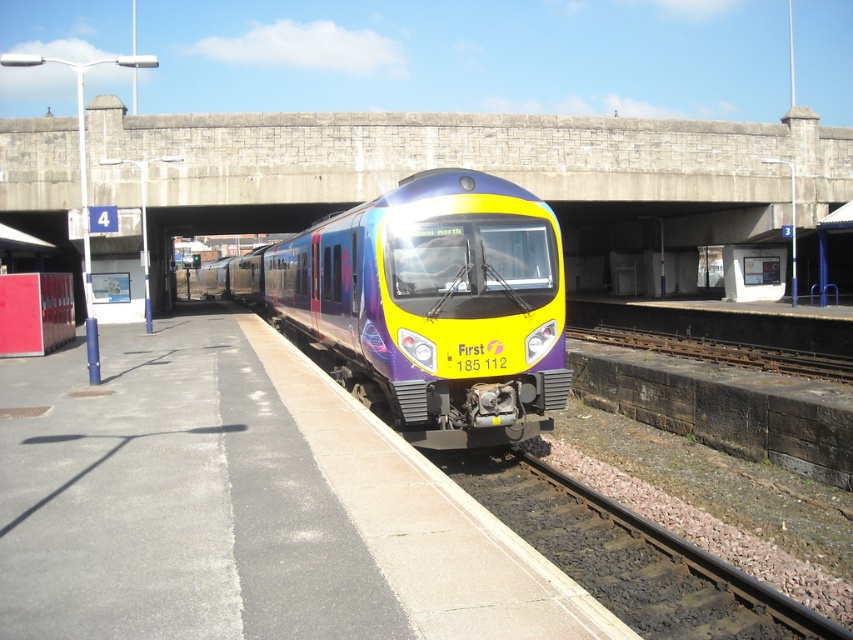
Question: Does matte purple train at center come in front of rusty metal track at lower right?

Choices:
 (A) yes
 (B) no

Answer: (A)

Question: Which of the following is the closest to the observer?

Choices:
 (A) rusty metal track at lower right
 (B) black gravel train track at lower center

Answer: (B)

Question: Which point is closer to the camera?

Choices:
 (A) smooth concrete platform at center
 (B) black gravel train track at lower center
 (C) matte purple train at center

Answer: (A)

Question: Is matte purple train at center above rusty metal track at lower right?

Choices:
 (A) no
 (B) yes

Answer: (B)

Question: Where is matte purple train at center located in relation to black gravel train track at lower center in the image?

Choices:
 (A) right
 (B) left

Answer: (B)

Question: Which point is farther to the camera?

Choices:
 (A) matte purple train at center
 (B) rusty metal track at lower right

Answer: (B)